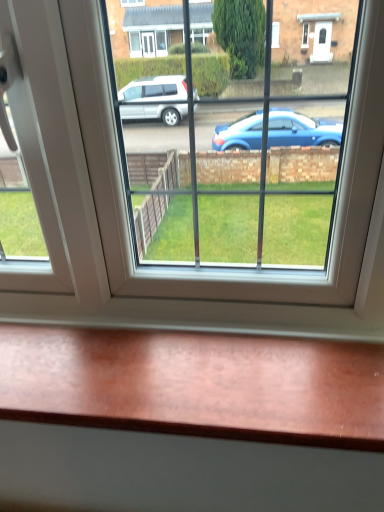
Image resolution: width=384 pixels, height=512 pixels. Find the location of `vacant space situated above wooden table at bottom (from a real-world perspective)`. vacant space situated above wooden table at bottom (from a real-world perspective) is located at coordinates (161, 371).